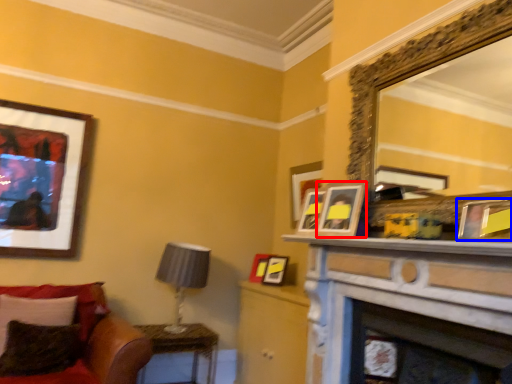
Question: Which object appears farthest to the camera in this image, picture frame (highlighted by a red box) or picture frame (highlighted by a blue box)?

Choices:
 (A) picture frame
 (B) picture frame

Answer: (A)